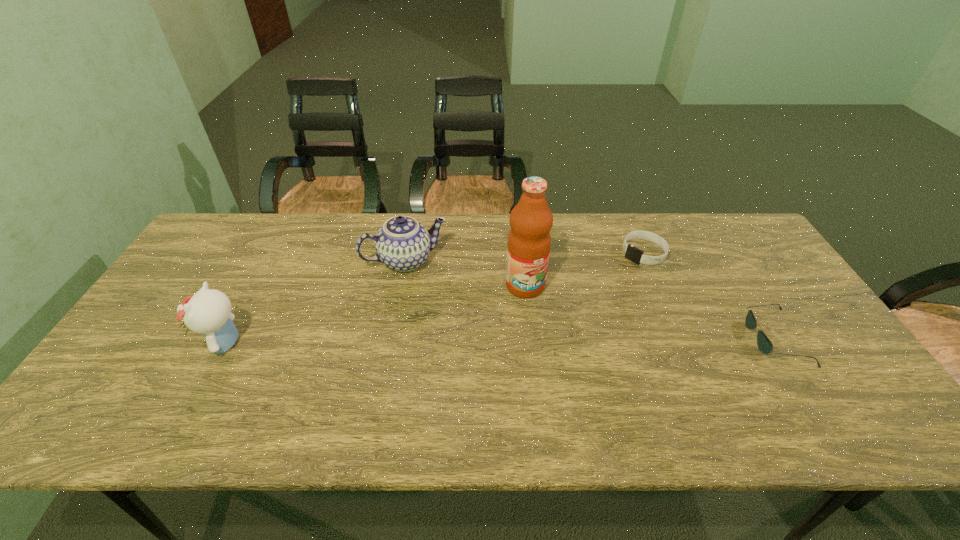
Locate an element on the screen. This screenshot has width=960, height=540. vacant space at the far right corner is located at coordinates (722, 214).

Locate an element on the screen. vacant space that's between the leftmost object and the second object from left to right is located at coordinates (316, 302).

Identify the location of free area in between the rightmost object and the chinaware. The height and width of the screenshot is (540, 960). (590, 300).

What are the coordinates of `free spot between the chinaware and the kitten` in the screenshot? It's located at (316, 302).

This screenshot has height=540, width=960. I want to click on empty space between the leftmost object and the fourth object from right to left, so click(x=316, y=302).

What are the coordinates of `vacant area that lies between the fruit juice and the second object from right to left` in the screenshot? It's located at (585, 269).

Locate an element on the screen. vacant area that lies between the kitten and the sunglasses is located at coordinates (500, 340).

Where is `vacant space that's between the tallest object and the kitten`? This screenshot has width=960, height=540. vacant space that's between the tallest object and the kitten is located at coordinates (375, 314).

Identify the location of free space between the wristband and the kitten. This screenshot has height=540, width=960. (435, 298).

I want to click on free space that is in between the kitten and the third object from left to right, so click(375, 314).